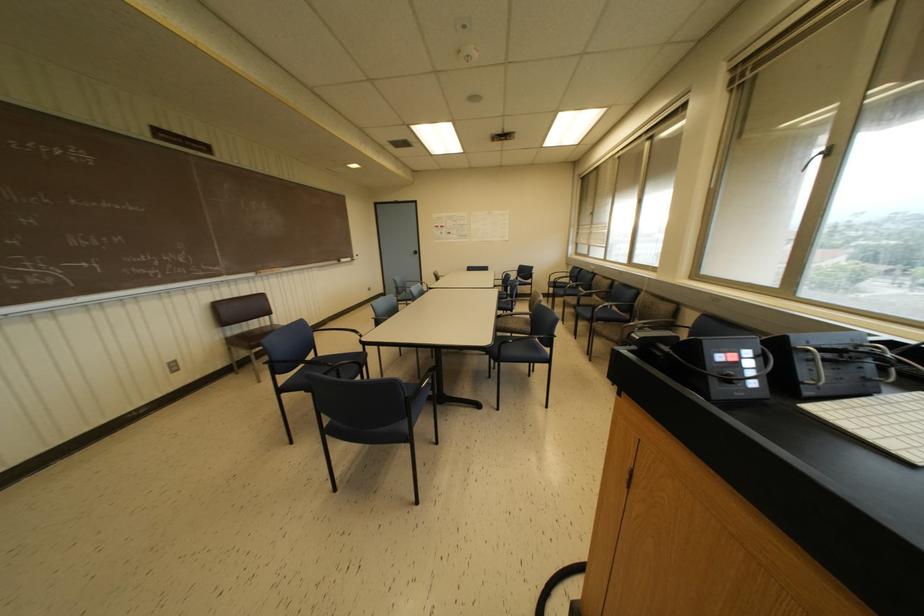
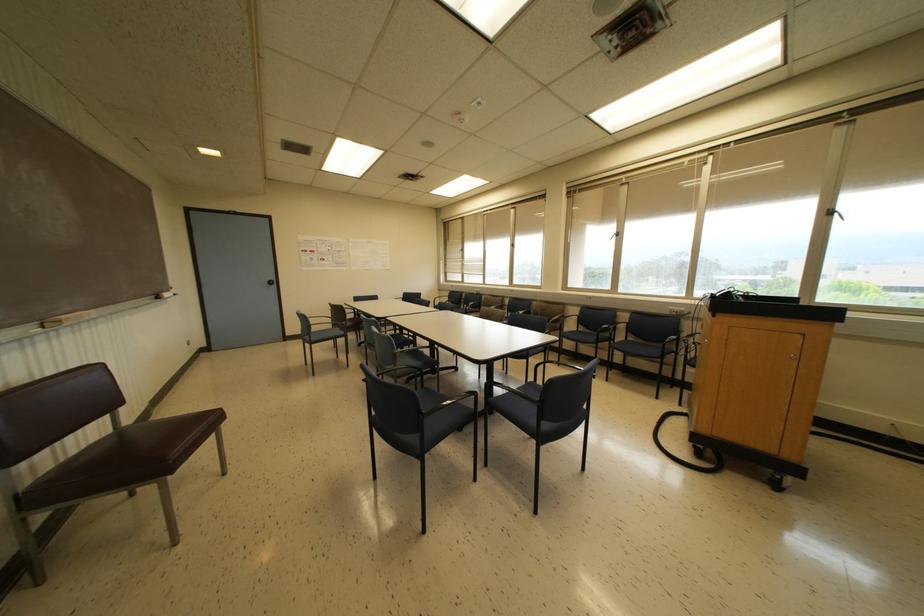
Locate, in the second image, the point that corresponds to (x=338, y=261) in the first image.

(157, 297)